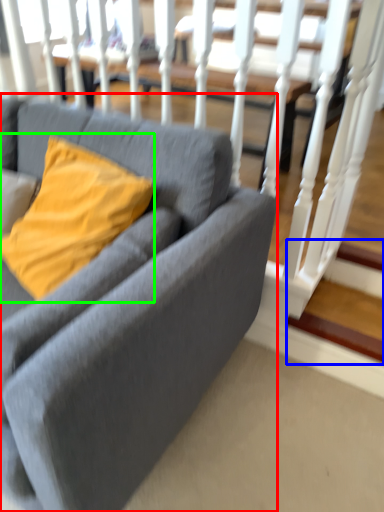
Question: Considering the real-world distances, which object is closest to studio couch (highlighted by a red box)? stairwell (highlighted by a blue box) or pillow (highlighted by a green box).

Choices:
 (A) stairwell
 (B) pillow

Answer: (B)